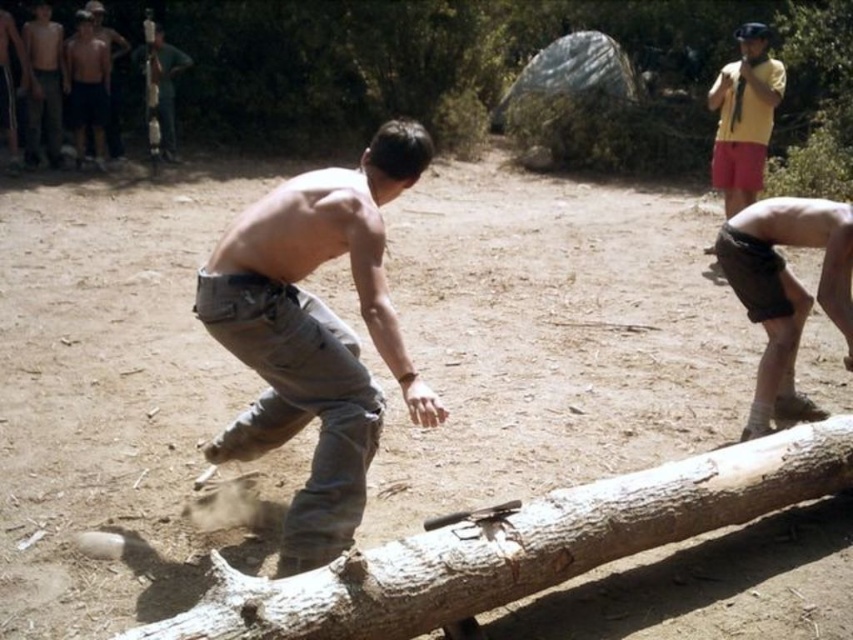
Question: Which point is closer to the camera taking this photo?

Choices:
 (A) (166, 97)
 (B) (303, 13)
 (C) (773, 272)
 (D) (102, 68)

Answer: (C)

Question: Based on their relative distances, which object is farther from the yellow matte shirt at upper right?

Choices:
 (A) brown rough log at center
 (B) tan cotton pants at center
 (C) black matte knee pad at lower right

Answer: (A)

Question: Can you confirm if brown rough log at center is positioned below black matte knee pad at lower right?

Choices:
 (A) no
 (B) yes

Answer: (A)

Question: Does black matte knee pad at lower right lie behind shiny metallic shirt at upper left?

Choices:
 (A) no
 (B) yes

Answer: (A)

Question: Which object appears farthest from the camera in this image?

Choices:
 (A) yellow matte shirt at upper right
 (B) shiny metallic shirt at upper left
 (C) tan cotton pants at center

Answer: (B)

Question: Can you confirm if black matte knee pad at lower right is positioned to the right of shiny metallic shirt at upper left?

Choices:
 (A) yes
 (B) no

Answer: (A)